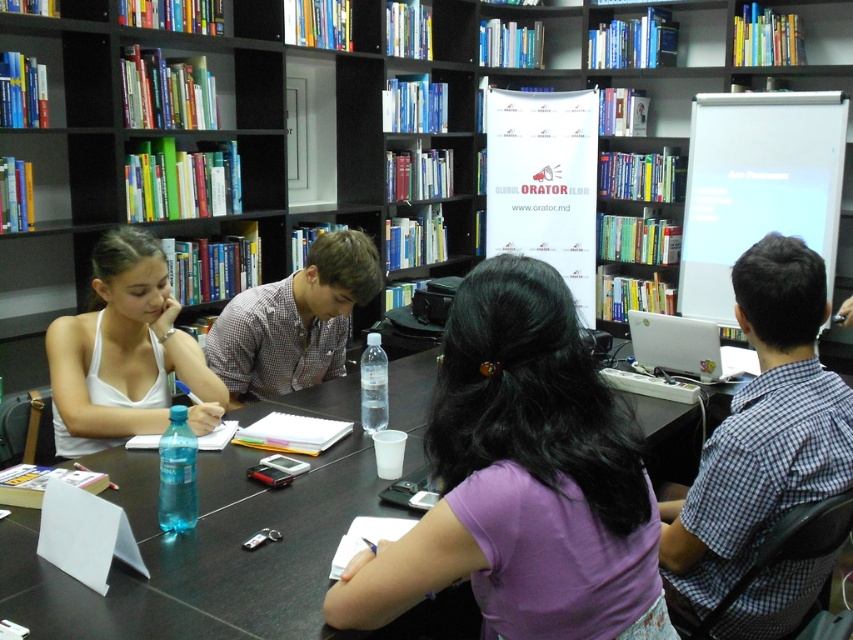
Can you confirm if purple cotton shirt at center is thinner than white glossy laptop at right?

In fact, purple cotton shirt at center might be wider than white glossy laptop at right.

Image resolution: width=853 pixels, height=640 pixels. What do you see at coordinates (520, 477) in the screenshot?
I see `purple cotton shirt at center` at bounding box center [520, 477].

You are a GUI agent. You are given a task and a screenshot of the screen. Output one action in this format:
    pyautogui.click(x=<x>, y=<y>)
    Task: Click on the purple cotton shirt at center
    
    Given the screenshot: What is the action you would take?
    pyautogui.click(x=520, y=477)

Looking at this image, which is more to the left, purple cotton shirt at center or black plastic table at center?

black plastic table at center is more to the left.

Is purple cotton shirt at center further to camera compared to black plastic table at center?

No, purple cotton shirt at center is in front of black plastic table at center.

Who is more distant from viewer, [490,593] or [221,595]?

Positioned behind is point [221,595].

Where is `purple cotton shirt at center`? The height and width of the screenshot is (640, 853). purple cotton shirt at center is located at coordinates (520, 477).

Looking at this image, which is below, purple cotton shirt at center or white matte tank top at left?

purple cotton shirt at center

Is point (631, 568) in front of point (115, 260)?

Yes.

Where is `purple cotton shirt at center`? Image resolution: width=853 pixels, height=640 pixels. purple cotton shirt at center is located at coordinates (520, 477).